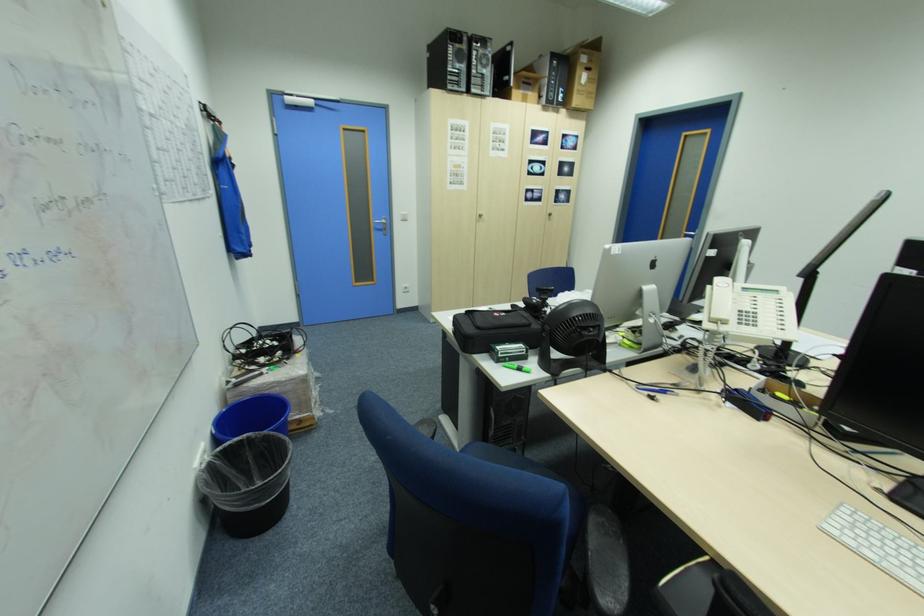
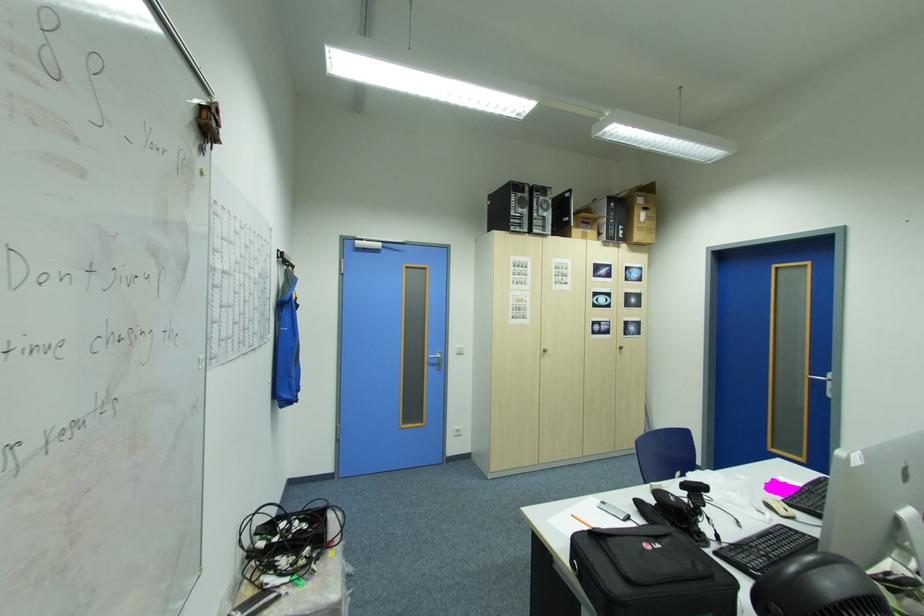
Which direction would the cameraman need to move to produce the second image?

The cameraman moved toward left, forward.